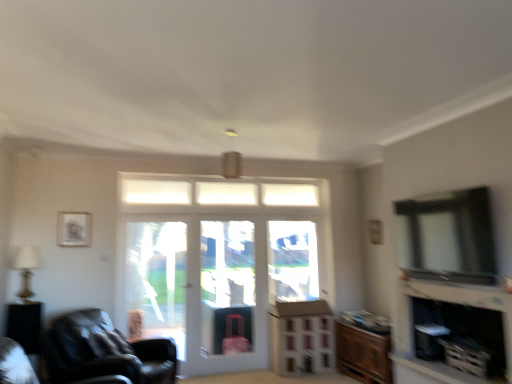
Question: Visually, is leather couch at lower left, the 2th chair viewed from the back, positioned to the left or to the right of matte silver lamp at left?

Choices:
 (A) left
 (B) right

Answer: (B)

Question: In terms of height, does leather couch at lower left, the 2th chair viewed from the back, look taller or shorter compared to matte silver lamp at left?

Choices:
 (A) short
 (B) tall

Answer: (A)

Question: Estimate the real-world distances between objects in this image. Which object is closer to the matte silver lamp at left?

Choices:
 (A) white glossy door at center
 (B) leather black chair at lower left, acting as the second chair starting from the front
 (C) matte white picture frame at upper left
 (D) transparent glass window at upper right
 (E) matte black fireplace at lower right

Answer: (C)

Question: Which of these objects is positioned farthest from the matte black fireplace at lower right?

Choices:
 (A) wooden cabinet at lower right
 (B) matte silver lamp at left
 (C) leather black chair at lower left, acting as the second chair starting from the front
 (D) leather couch at lower left, positioned as the first chair in front-to-back order
 (E) transparent glass window at upper right

Answer: (B)